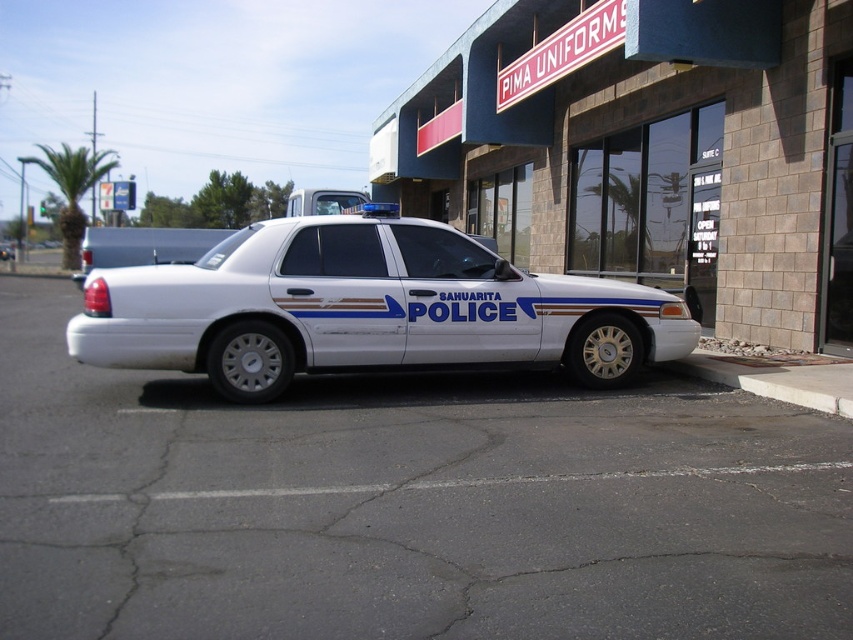
Question: Does blue brick storefront at center have a smaller size compared to concrete at lower right?

Choices:
 (A) no
 (B) yes

Answer: (A)

Question: Can you confirm if blue brick storefront at center is positioned above concrete at lower right?

Choices:
 (A) no
 (B) yes

Answer: (B)

Question: Is blue brick storefront at center bigger than white concrete curb at lower right?

Choices:
 (A) yes
 (B) no

Answer: (A)

Question: Which of these objects is positioned farthest from the concrete at lower right?

Choices:
 (A) blue brick storefront at center
 (B) white concrete curb at lower right

Answer: (A)

Question: Which object is positioned farthest from the blue brick storefront at center?

Choices:
 (A) white metallic police car at center
 (B) concrete at lower right
 (C) white concrete curb at lower right

Answer: (A)

Question: Which of the following is the closest to the observer?

Choices:
 (A) (578, 74)
 (B) (749, 387)

Answer: (B)